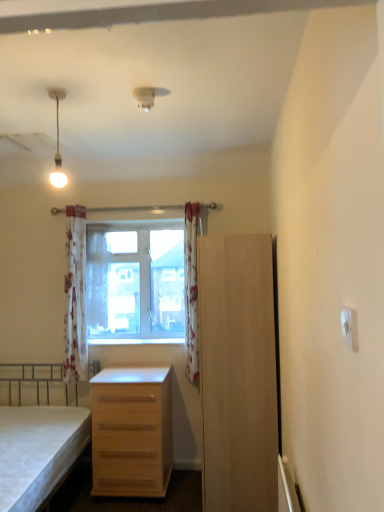
Question: In which direction should I rotate to look at white plastic smoke detector at upper center?

Choices:
 (A) right
 (B) left

Answer: (B)

Question: Is white floral fabric curtain at center, the second curtain when ordered from left to right, facing away from light wood cabinet at right?

Choices:
 (A) no
 (B) yes

Answer: (A)

Question: Is white floral fabric curtain at center, which ranks as the second curtain in right-to-left order, further to camera compared to light wood cabinet at right?

Choices:
 (A) no
 (B) yes

Answer: (B)

Question: Can you confirm if white floral fabric curtain at center, the second curtain when ordered from left to right, is taller than light wood cabinet at right?

Choices:
 (A) yes
 (B) no

Answer: (B)

Question: Is white floral fabric curtain at center, which ranks as the second curtain in right-to-left order, touching light wood cabinet at right?

Choices:
 (A) yes
 (B) no

Answer: (B)

Question: Does white floral fabric curtain at center, which ranks as the second curtain in right-to-left order, come in front of light wood cabinet at right?

Choices:
 (A) no
 (B) yes

Answer: (A)

Question: Is white floral fabric curtain at center, the second curtain when ordered from left to right, thinner than light wood cabinet at right?

Choices:
 (A) yes
 (B) no

Answer: (A)

Question: Does white floral fabric curtain at center, the second curtain when ordered from left to right, have a greater height compared to transparent glass window at center?

Choices:
 (A) yes
 (B) no

Answer: (B)

Question: Does white floral fabric curtain at center, which ranks as the second curtain in right-to-left order, have a lesser width compared to transparent glass window at center?

Choices:
 (A) no
 (B) yes

Answer: (A)

Question: From a real-world perspective, is white floral fabric curtain at center, which ranks as the second curtain in right-to-left order, beneath transparent glass window at center?

Choices:
 (A) yes
 (B) no

Answer: (B)

Question: Are white floral fabric curtain at center, the second curtain when ordered from left to right, and transparent glass window at center far apart?

Choices:
 (A) no
 (B) yes

Answer: (A)

Question: Is white floral fabric curtain at center, the second curtain when ordered from left to right, aimed at transparent glass window at center?

Choices:
 (A) yes
 (B) no

Answer: (B)

Question: From the image's perspective, does white floral fabric curtain at center, which ranks as the second curtain in right-to-left order, appear lower than transparent glass window at center?

Choices:
 (A) no
 (B) yes

Answer: (A)

Question: Does light wood cabinet at right appear on the left side of transparent glass window at center?

Choices:
 (A) no
 (B) yes

Answer: (A)